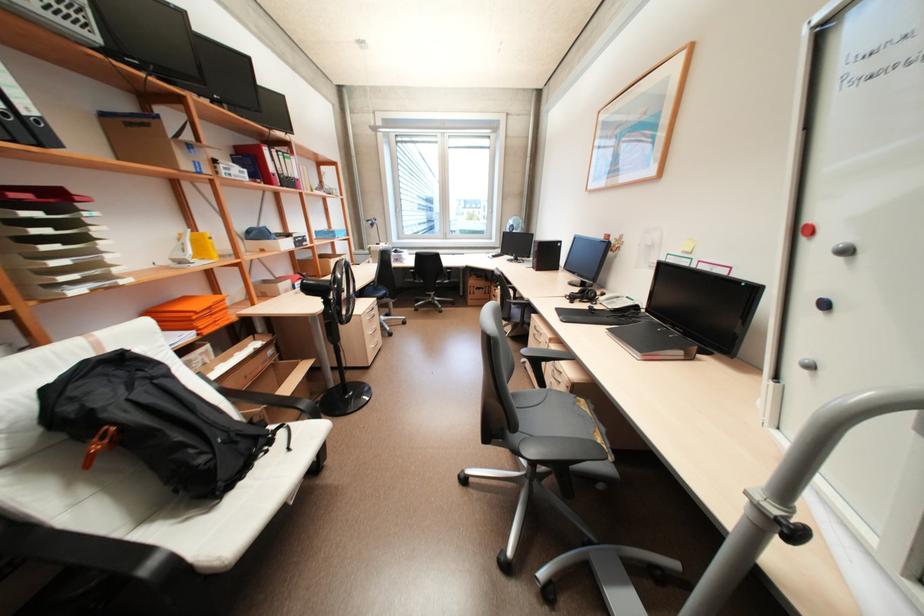
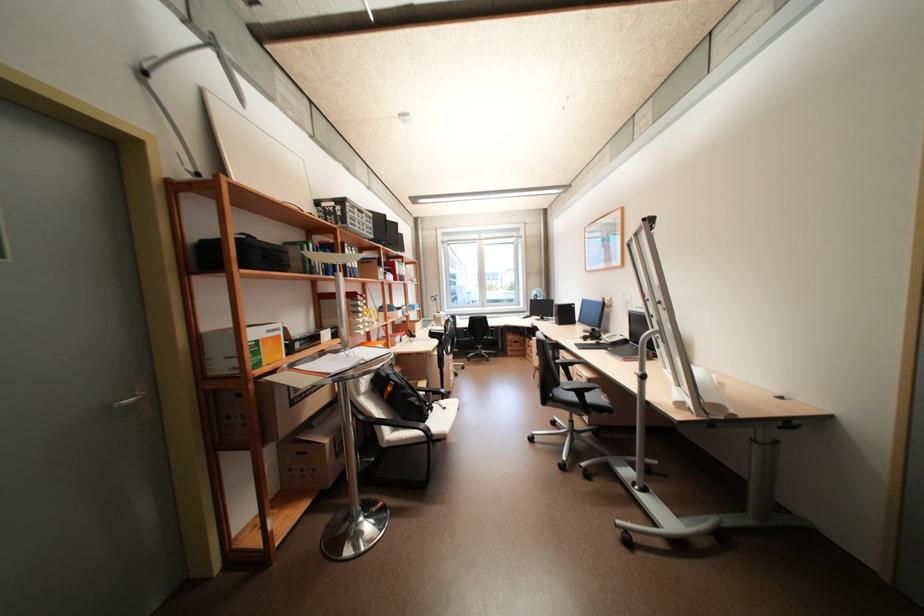
Find the pixel in the second image that matches the point at 597,307 in the first image.

(603, 342)